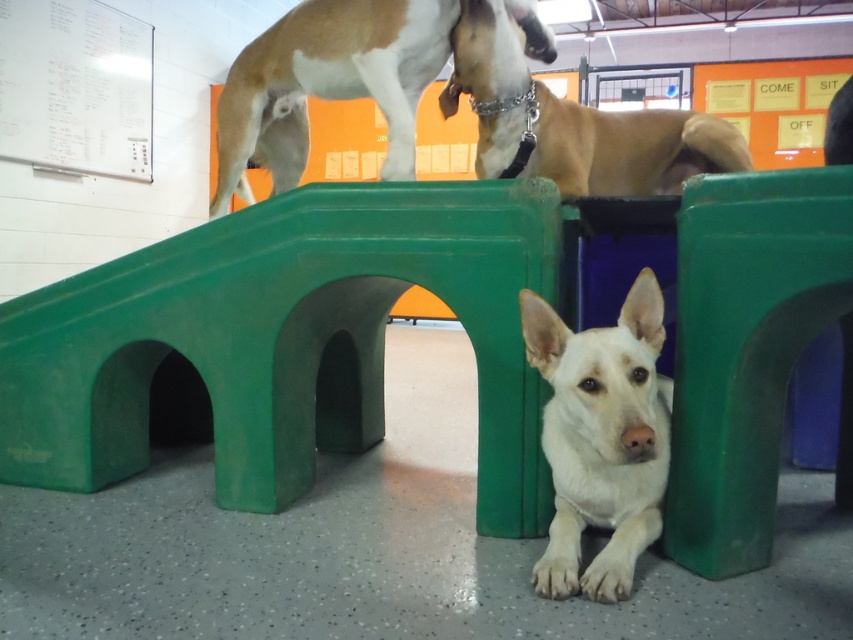
Question: Does white glossy dog at upper center appear under brown matte dog at upper center?

Choices:
 (A) no
 (B) yes

Answer: (A)

Question: Can you confirm if green plastic hurdle at lower center is positioned to the left of brown matte dog at upper center?

Choices:
 (A) no
 (B) yes

Answer: (B)

Question: Does white matte dog at lower center lie behind white glossy dog at upper center?

Choices:
 (A) yes
 (B) no

Answer: (B)

Question: Which object appears closest to the camera in this image?

Choices:
 (A) white glossy dog at upper center
 (B) white matte dog at lower center
 (C) green plastic hurdle at lower center
 (D) brown matte dog at upper center

Answer: (B)

Question: Which object is positioned closest to the white glossy dog at upper center?

Choices:
 (A) white matte dog at lower center
 (B) brown matte dog at upper center

Answer: (B)

Question: Which of the following is the farthest from the observer?

Choices:
 (A) (537, 564)
 (B) (674, 454)
 (C) (469, 3)
 (D) (354, 97)

Answer: (D)